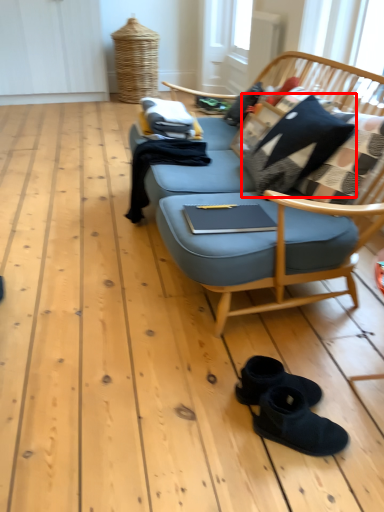
Question: From the image's perspective, considering the relative positions of pillow (annotated by the red box) and footwear in the image provided, where is pillow (annotated by the red box) located with respect to the staircase?

Choices:
 (A) above
 (B) below

Answer: (A)